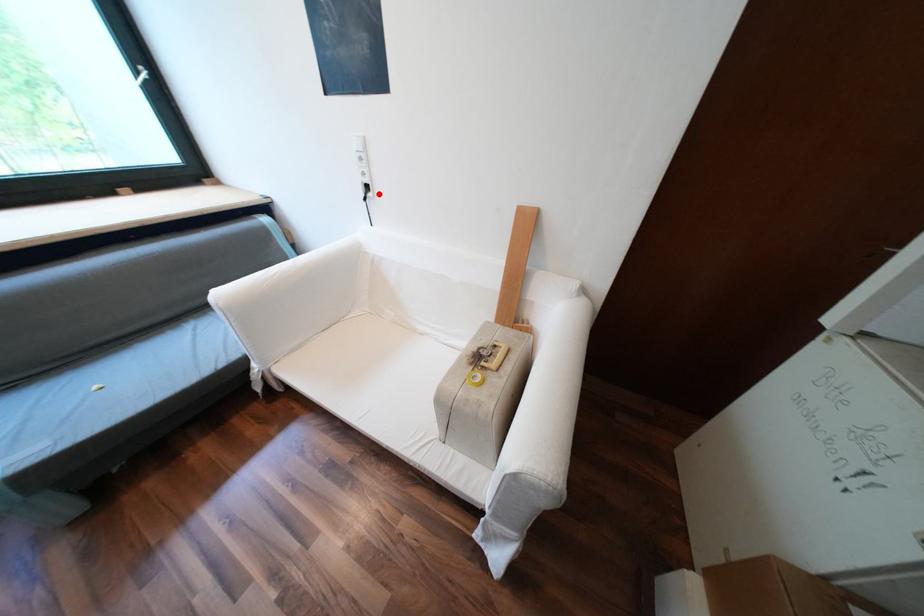
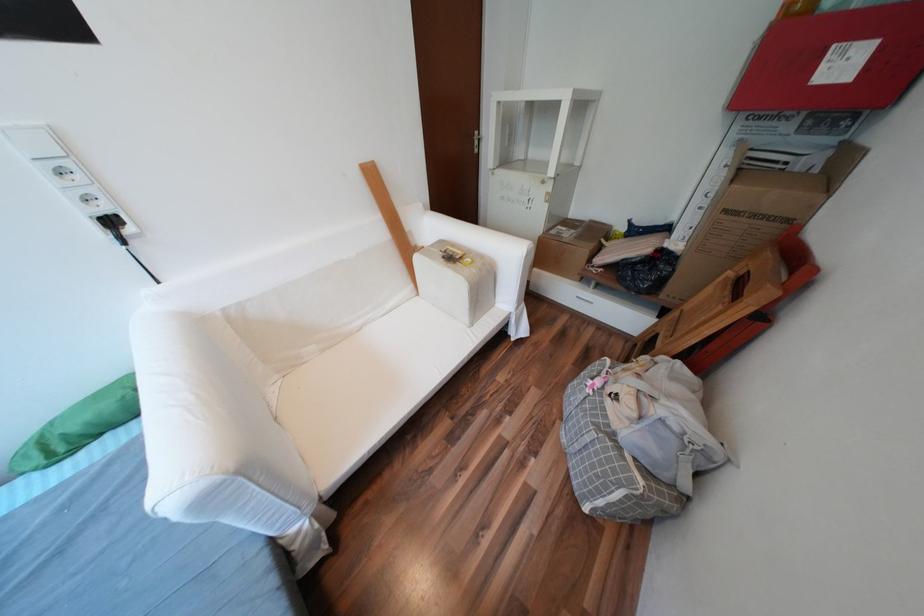
Where in the second image is the point corresponding to the highlighted location from the first image?

(138, 231)